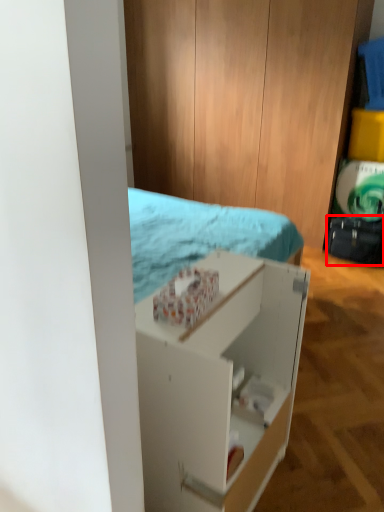
Question: From the image, what is the correct spatial relationship of luggage (annotated by the red box) in relation to shelf?

Choices:
 (A) left
 (B) right

Answer: (B)